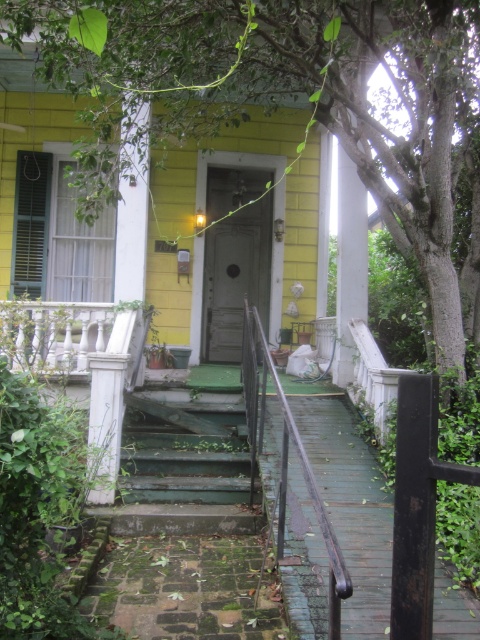
Question: Can you confirm if green weathered wood stairs at center is positioned below white marble balustrade at left?

Choices:
 (A) yes
 (B) no

Answer: (A)

Question: Is green painted wood porch at center closer to the viewer compared to green weathered wood stairs at center?

Choices:
 (A) yes
 (B) no

Answer: (B)

Question: Which of the following is the farthest from the observer?

Choices:
 (A) rusty metal railing at lower right
 (B) green weathered wood stairs at center

Answer: (A)

Question: Which of these objects is positioned farthest from the green painted wood porch at center?

Choices:
 (A) green weathered wood stairs at center
 (B) rusty metal railing at lower right

Answer: (A)

Question: Which is farther from the white marble balustrade at left?

Choices:
 (A) green painted wood porch at center
 (B) rusty metal railing at lower right
 (C) green weathered wood stairs at center

Answer: (B)

Question: Is green painted wood porch at center wider than rusty metal railing at lower right?

Choices:
 (A) yes
 (B) no

Answer: (A)